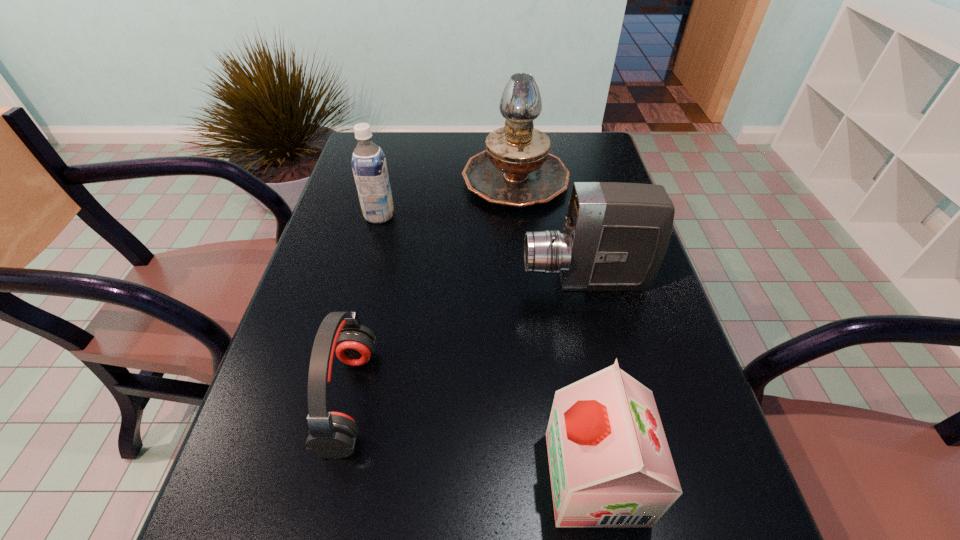
At what (x,y) coordinates should I click in order to perform the action: click on object present at the far right corner. Please return your answer as a coordinate pair (x, y). The width and height of the screenshot is (960, 540). Looking at the image, I should click on (516, 170).

This screenshot has width=960, height=540. In the image, there is a desktop. In order to click on free space at the far edge in this screenshot , I will do `click(464, 149)`.

Locate an element on the screen. This screenshot has width=960, height=540. vacant area at the left edge of the desktop is located at coordinates (333, 286).

Locate an element on the screen. This screenshot has height=540, width=960. blank space at the right edge of the desktop is located at coordinates (617, 334).

Find the location of `free space at the far left corner`. free space at the far left corner is located at coordinates (398, 148).

This screenshot has height=540, width=960. Identify the location of free spot between the farther soya milk and the nearer soya milk. (488, 347).

Locate an element on the screen. This screenshot has height=540, width=960. vacant point located between the right soya milk and the oil lamp is located at coordinates (555, 328).

You are a GUI agent. You are given a task and a screenshot of the screen. Output one action in this format:
    pyautogui.click(x=<x>, y=<y>)
    Task: Click on the vacant space that is in between the shortest object and the left soya milk
    The image size is (960, 540).
    Given the screenshot: What is the action you would take?
    pyautogui.click(x=364, y=307)

Identify the location of free space between the camcorder and the oil lamp. (550, 230).

Locate an element on the screen. The image size is (960, 540). free space between the right soya milk and the oil lamp is located at coordinates (555, 328).